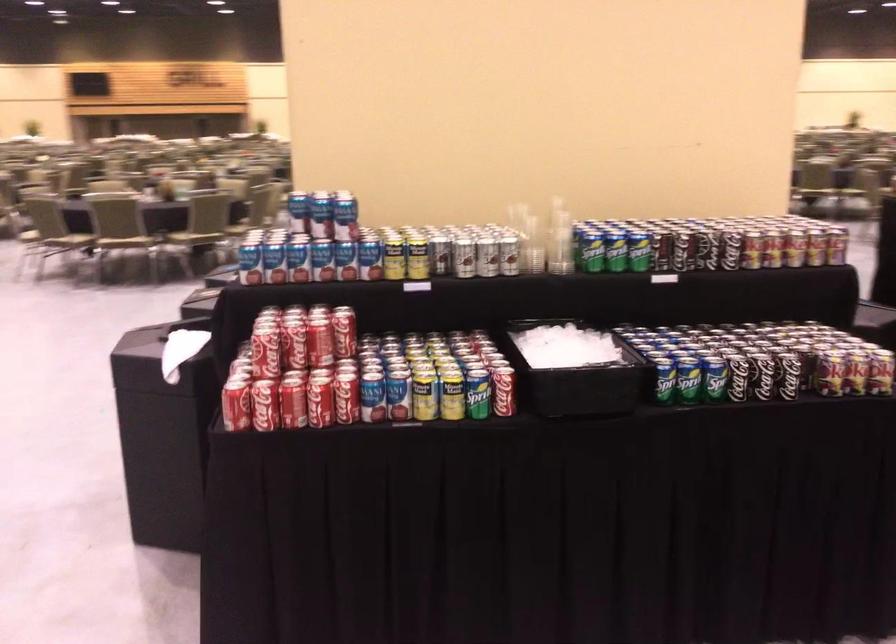
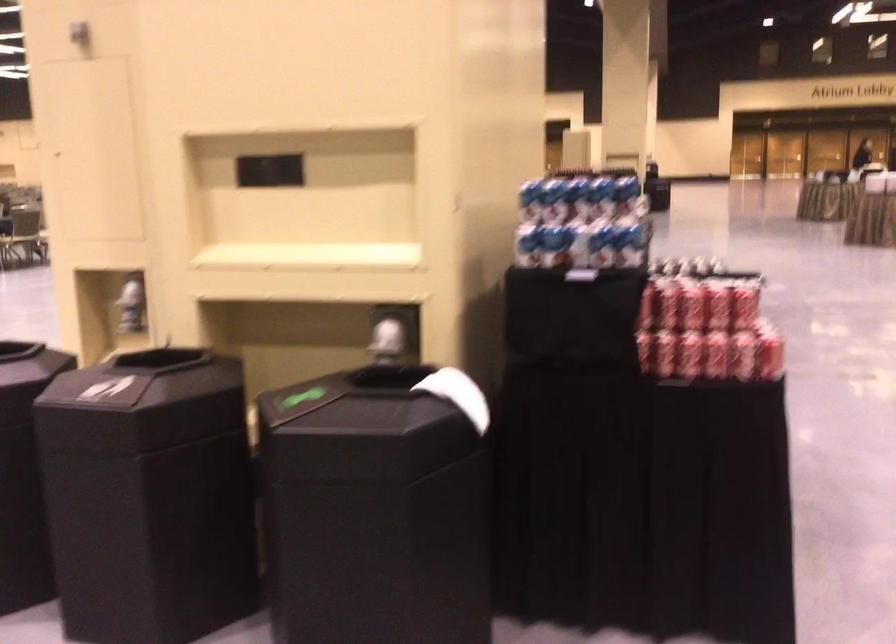
In the second image, find the point that corresponds to point 238,365 in the first image.

(664, 353)